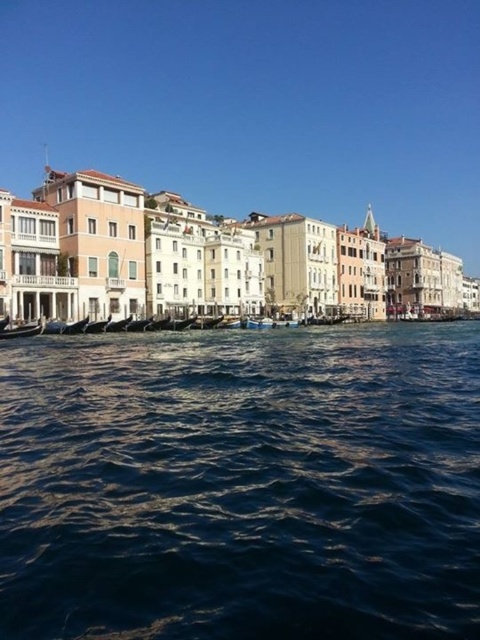
Question: Is dark blue water at center bigger than wooden gondola at lower left?

Choices:
 (A) yes
 (B) no

Answer: (A)

Question: Does dark blue water at center have a lesser width compared to wooden gondola at lower left?

Choices:
 (A) yes
 (B) no

Answer: (B)

Question: Is dark blue water at center thinner than wooden gondola at lower left?

Choices:
 (A) yes
 (B) no

Answer: (B)

Question: Which object appears farthest from the camera in this image?

Choices:
 (A) dark blue water at center
 (B) wooden gondola at lower left

Answer: (B)